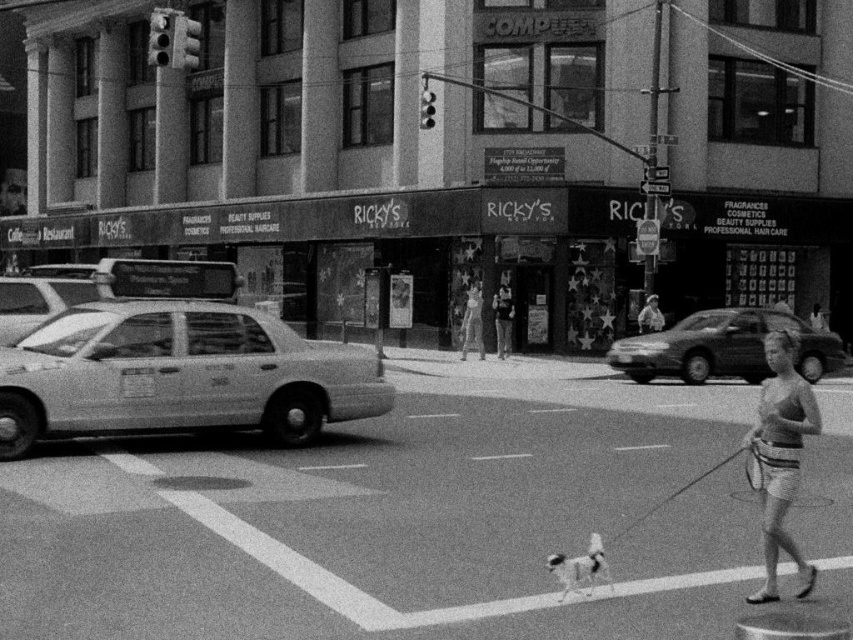
You are a pedestrian standing on the sidewalk in front of Ricky s beauty supply store. You see two taxis at the left side of the street. Which taxi is closer to you, the matte white taxi at left or the white glossy taxi cab at left?

The matte white taxi at left is closer to you because it has a smaller size compared to the white glossy taxi cab at left.

You are standing on the sidewalk and see the striped fabric shorts at lower right and the smooth beige hat at center. Which item is nearer to you?

The striped fabric shorts at lower right is closer to the viewer than the smooth beige hat at center.